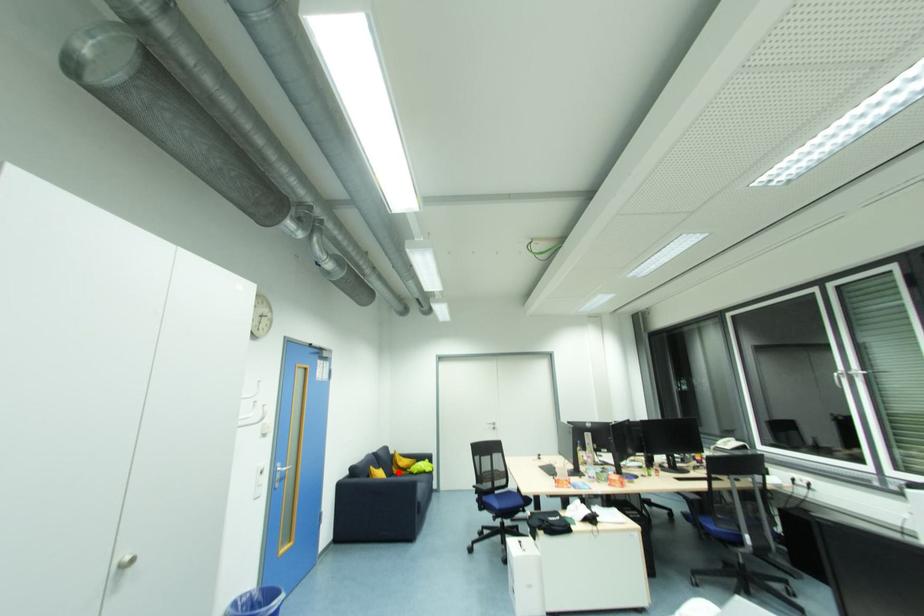
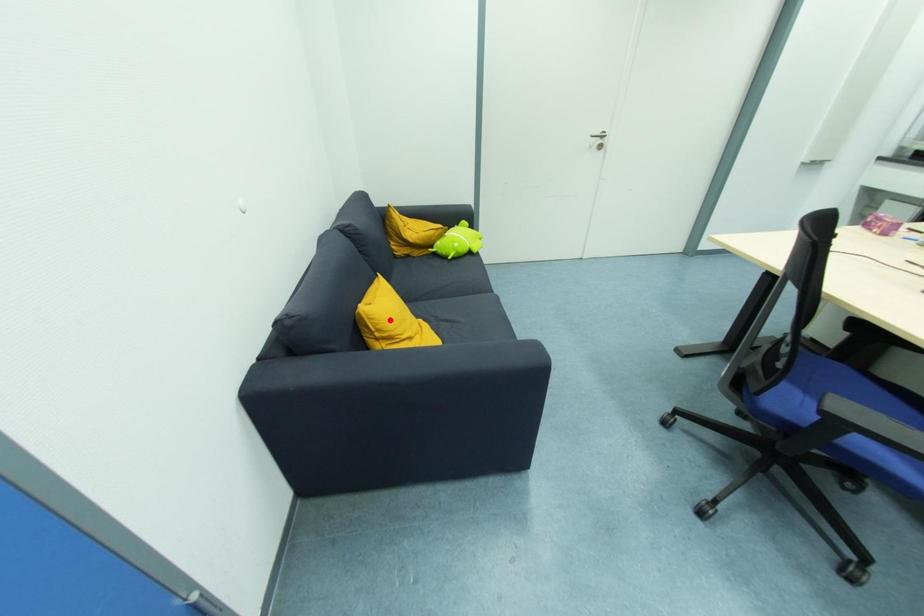
I am providing you with two images of the same scene from different viewpoints. A red point is marked on the first image and another point is marked on the second image. Are the points marked in image1 and image2 representing the same 3D position?

No